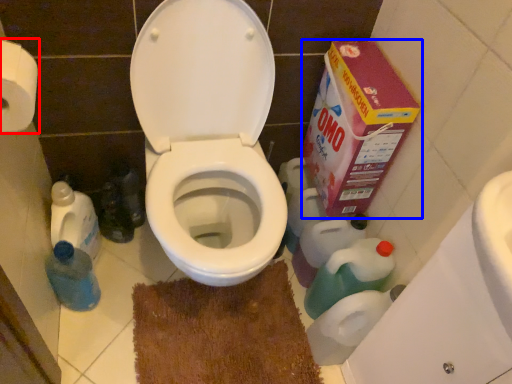
Question: Among these objects, which one is nearest to the camera, toilet paper (highlighted by a red box) or cardboard box (highlighted by a blue box)?

Choices:
 (A) toilet paper
 (B) cardboard box

Answer: (A)